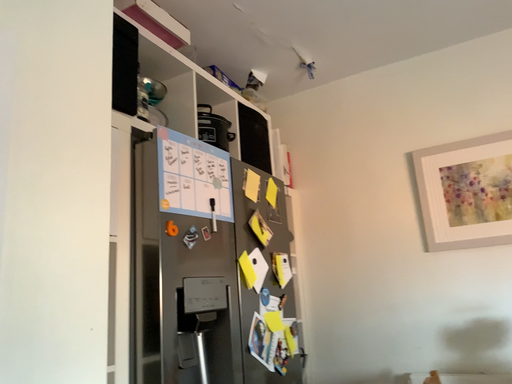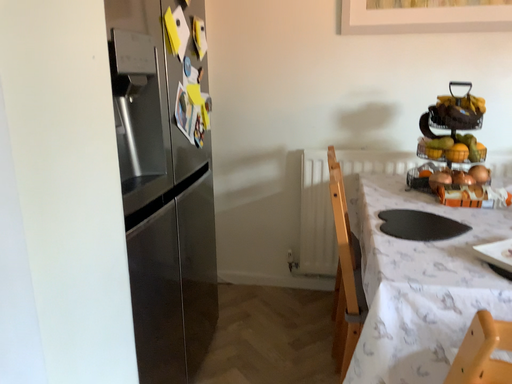
Question: Which way did the camera rotate in the video?

Choices:
 (A) rotated left
 (B) rotated right

Answer: (B)